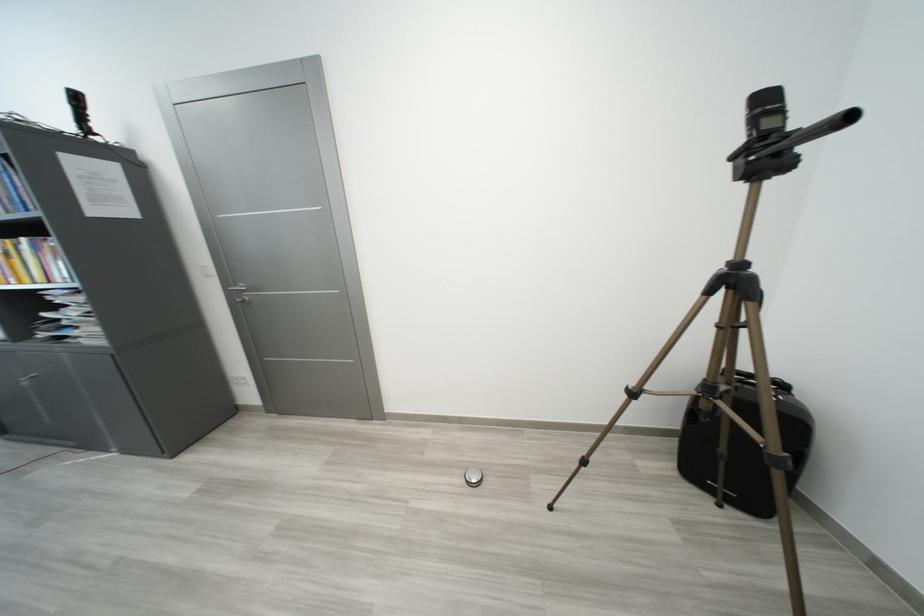
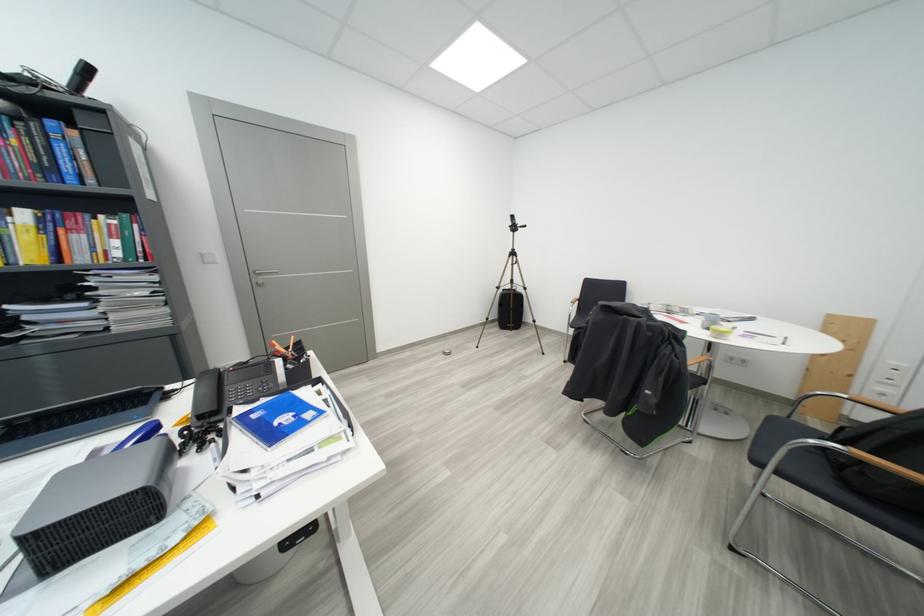
Question: I am providing you with two images of the same scene from different viewpoints. Please identify which objects are invisible in image2.

Choices:
 (A) white light switch
 (B) black case handle
 (C) wooden chair armrest
 (D) wicker plant pot

Answer: (B)